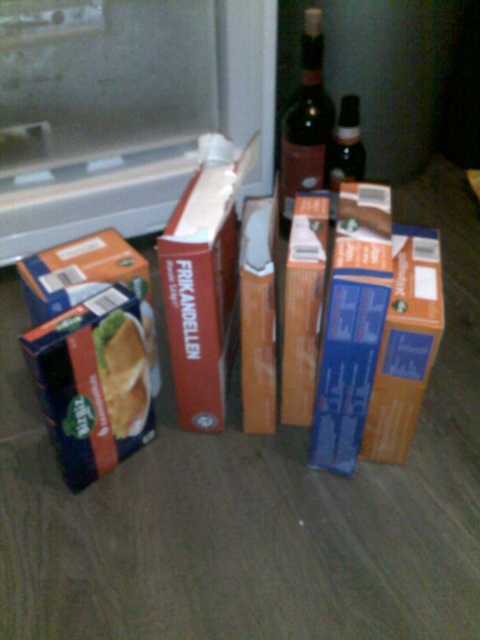
You are organizing items in a pantry and need to place the blue cardboard box at left and the shiny dark glass bottle at upper center on a shelf. The shelf has limited space. Which item should you place first to ensure both fit?

The blue cardboard box at left is smaller than the shiny dark glass bottle at upper center, so place the smaller blue cardboard box at left first to make space for the larger bottle.

You are organizing a picnic and have a blue cardboard box at lower left and a golden crisp bread at left. Which item is positioned more to the left?

The blue cardboard box at lower left is positioned more to the left than the golden crisp bread at left.

You are organizing a picnic and have a blue cardboard box at left and a shiny dark glass bottle at upper center. Which item has a greater width?

The blue cardboard box at left has a greater width than the shiny dark glass bottle at upper center.